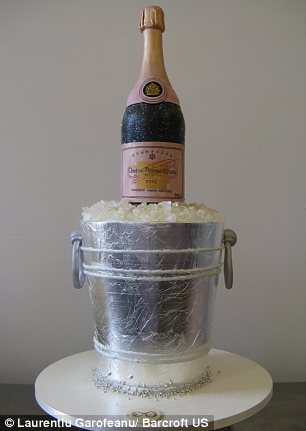
Where is `bottle`? The height and width of the screenshot is (431, 306). bottle is located at coordinates (175, 130).